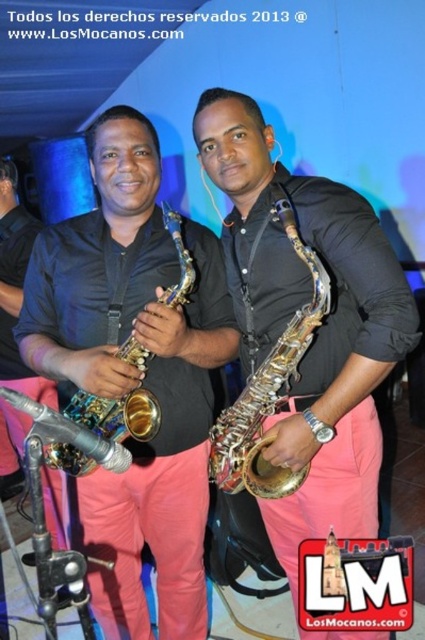
Is gold metallic saxophone at center wider than brushed metal saxophone at center?

Incorrect, gold metallic saxophone at center's width does not surpass brushed metal saxophone at center's.

Between point (252, 493) and point (133, 365), which one is positioned behind?

Positioned behind is point (252, 493).

Is point (252, 422) farther from viewer compared to point (176, 298)?

Yes, point (252, 422) is behind point (176, 298).

You are a GUI agent. You are given a task and a screenshot of the screen. Output one action in this format:
    pyautogui.click(x=<x>, y=<y>)
    Task: Click on the gold metallic saxophone at center
    The width and height of the screenshot is (425, 640).
    Given the screenshot: What is the action you would take?
    pyautogui.click(x=269, y=388)

Can you confirm if metallic saxophone at center is smaller than gold metallic saxophone at center?

Incorrect, metallic saxophone at center is not smaller in size than gold metallic saxophone at center.

Which is behind, point (93, 602) or point (306, 310)?

The point (93, 602) is behind.

Where is `metallic saxophone at center`? metallic saxophone at center is located at coordinates (133, 376).

Which is more to the right, satin gold saxophone at center or gold metallic saxophone at center?

Positioned to the right is satin gold saxophone at center.

Is point (305, 298) in front of point (322, 262)?

That is False.

Locate an element on the screen. This screenshot has width=425, height=640. satin gold saxophone at center is located at coordinates (317, 330).